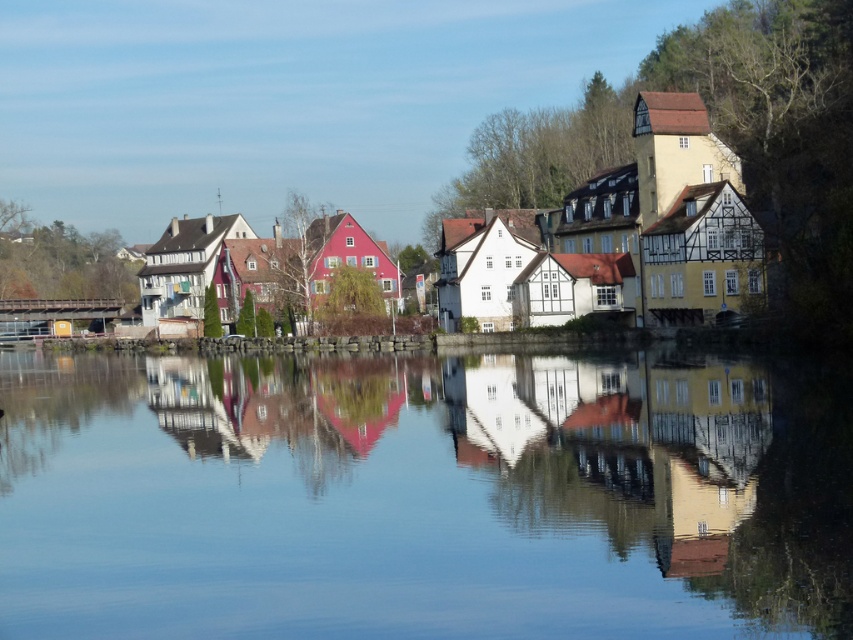
Consider the image. Can you confirm if transparent glass water at center is shorter than wooden houses at center?

Indeed, transparent glass water at center has a lesser height compared to wooden houses at center.

Between transparent glass water at center and wooden houses at center, which one has more height?

wooden houses at center is taller.

Who is more forward, (136, 385) or (509, 200)?

Point (136, 385) is in front.

Where is `transparent glass water at center`? transparent glass water at center is located at coordinates (422, 497).